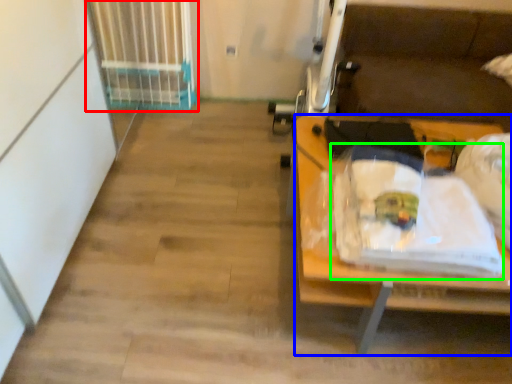
Question: Which object is positioned closest to radiator (highlighted by a red box)? Select from desk (highlighted by a blue box) and waste (highlighted by a green box).

Choices:
 (A) desk
 (B) waste

Answer: (B)